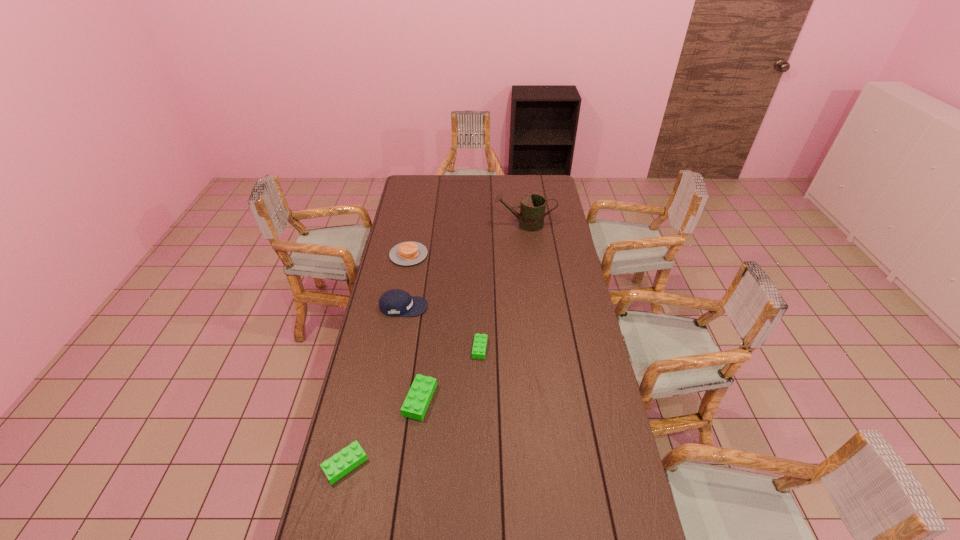
Identify the location of the fourth nearest object. This screenshot has height=540, width=960. (395, 302).

Locate an element on the screen. The image size is (960, 540). blank space located on the back of the nearest object is located at coordinates (369, 364).

This screenshot has height=540, width=960. I want to click on vacant region located 0.240m on the back of the second Lego from left to right, so click(428, 330).

In order to click on free region located 0.230m on the back of the shortest object in this screenshot , I will do `click(480, 298)`.

This screenshot has width=960, height=540. What are the coordinates of `vacant region located with the spout on the farthest object` in the screenshot? It's located at (450, 225).

The width and height of the screenshot is (960, 540). Find the location of `vacant point located 0.290m with the spout on the farthest object`. vacant point located 0.290m with the spout on the farthest object is located at coordinates (439, 225).

Where is `blank space located with the spout on the farthest object`? Image resolution: width=960 pixels, height=540 pixels. blank space located with the spout on the farthest object is located at coordinates (428, 225).

Image resolution: width=960 pixels, height=540 pixels. What are the coordinates of `free space located 0.050m on the back of the pancake` in the screenshot? It's located at (412, 237).

This screenshot has height=540, width=960. I want to click on vacant space located on the front-facing side of the fifth shortest object, so click(x=484, y=307).

What are the coordinates of `Lego that is positioned at the left edge` in the screenshot? It's located at (341, 463).